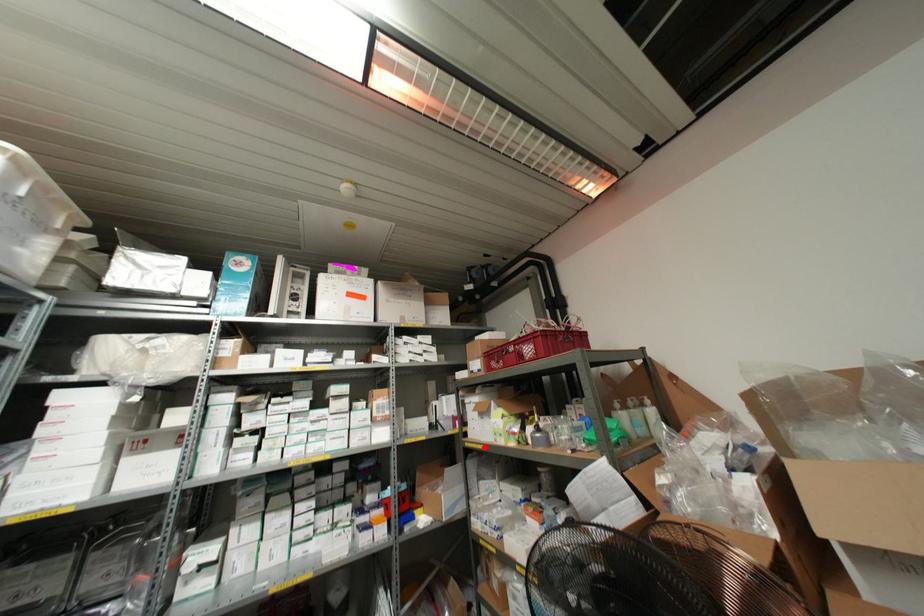
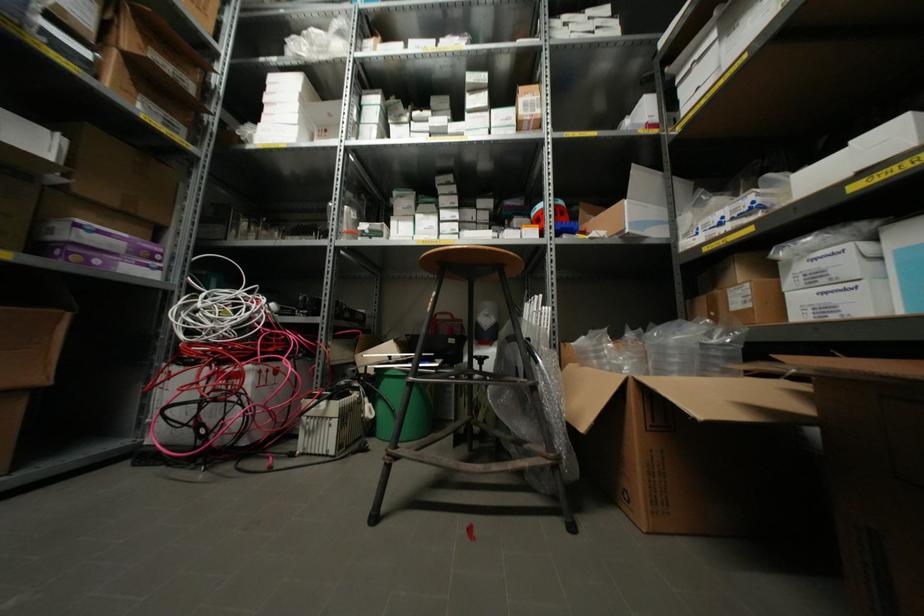
Locate, in the second image, the point that corresponds to the highlighted location in the first image.

(743, 55)